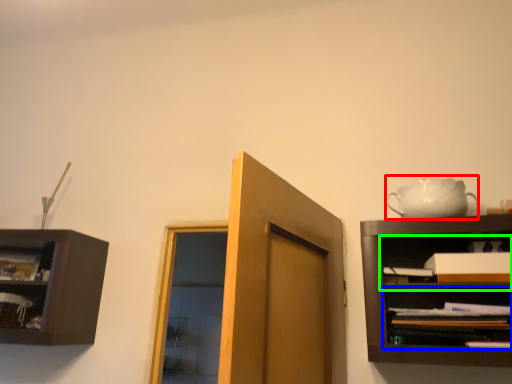
Question: Considering the real-world distances, which object is closest to tea set (highlighted by a red box)? shelf (highlighted by a blue box) or cabinet (highlighted by a green box).

Choices:
 (A) shelf
 (B) cabinet

Answer: (B)